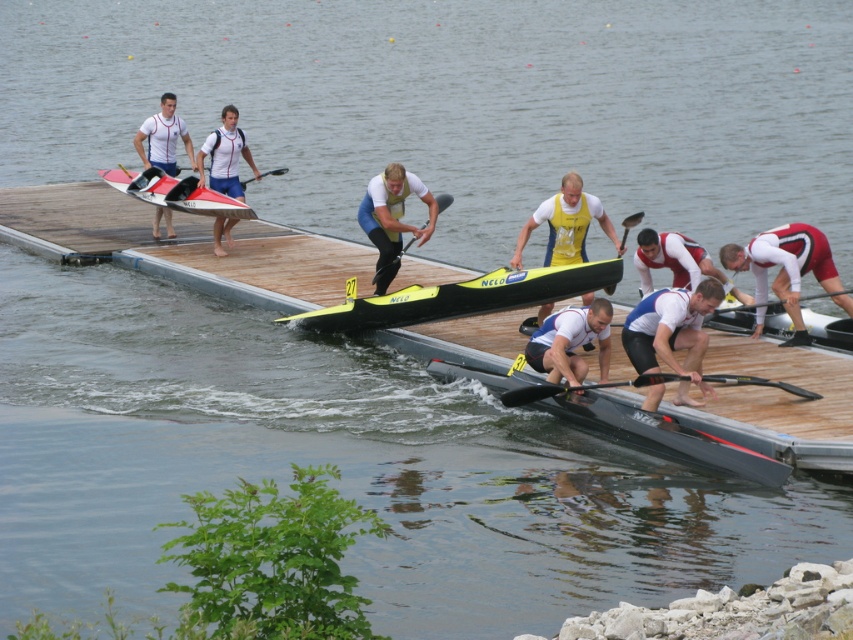
Who is positioned more to the right, yellow matte kayak at center or black rubber paddle at center?

From the viewer's perspective, black rubber paddle at center appears more on the right side.

Who is lower down, yellow matte kayak at center or black rubber paddle at center?

yellow matte kayak at center

Who is more distant from viewer, (737, 403) or (440, 211)?

Positioned behind is point (440, 211).

Where is `yellow matte kayak at center`? yellow matte kayak at center is located at coordinates (183, 248).

Is yellow matte kayak at center closer to the viewer compared to black rubber paddle at upper center?

Yes.

Can you confirm if yellow matte kayak at center is smaller than black rubber paddle at upper center?

Actually, yellow matte kayak at center might be larger than black rubber paddle at upper center.

The width and height of the screenshot is (853, 640). Find the location of `yellow matte kayak at center`. yellow matte kayak at center is located at coordinates (183, 248).

Which is below, yellow fabric rower at center or black rubber paddle at lower center?

black rubber paddle at lower center is lower down.

Does yellow fabric rower at center have a larger size compared to black rubber paddle at lower center?

Yes.

This screenshot has height=640, width=853. I want to click on yellow fabric rower at center, so click(566, 225).

Where is `yellow fabric rower at center`? This screenshot has width=853, height=640. yellow fabric rower at center is located at coordinates (566, 225).